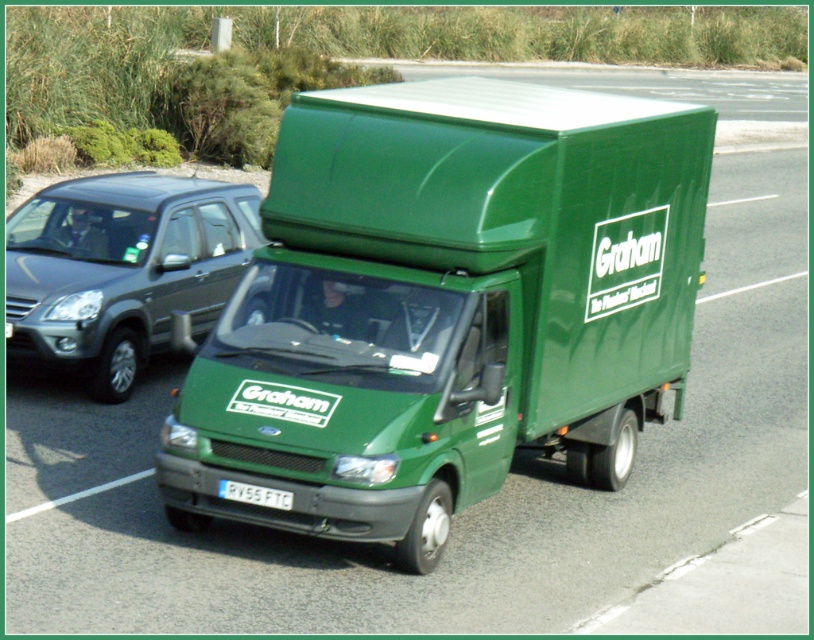
You are a traffic officer observing a green matte truck at center and a white plastic license plate at center. Which object is positioned higher in the image?

The green matte truck at center is located above the white plastic license plate at center, so it is positioned higher in the image.

You are a traffic officer observing the road. You see a metallic gray suv at left and a white plastic license plate at center. Which object is taller?

The metallic gray suv at left is taller than the white plastic license plate at center.